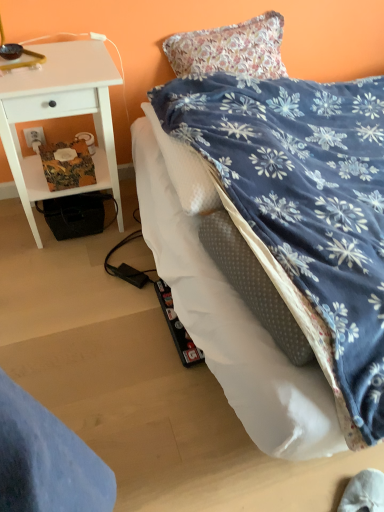
Question: Based on their sizes in the image, would you say blue velvety bed at center is bigger or smaller than white plastic power outlet at lower left?

Choices:
 (A) small
 (B) big

Answer: (B)

Question: Considering the relative positions of blue velvety bed at center and white plastic power outlet at lower left in the image provided, is blue velvety bed at center to the left or to the right of white plastic power outlet at lower left?

Choices:
 (A) left
 (B) right

Answer: (B)

Question: Estimate the real-world distances between objects in this image. Which object is closer to the white wood desk at left?

Choices:
 (A) blue velvety bed at center
 (B) white plastic power outlet at lower left

Answer: (B)

Question: Which of these objects is positioned closest to the white plastic power outlet at lower left?

Choices:
 (A) blue velvety bed at center
 (B) white wood desk at left

Answer: (B)